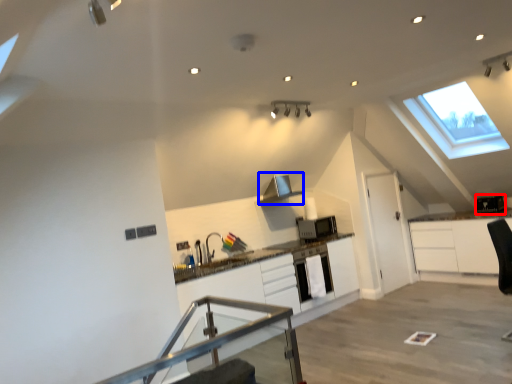
Question: Among these objects, which one is nearest to the camera, appliance (highlighted by a red box) or exhaust hood (highlighted by a blue box)?

Choices:
 (A) appliance
 (B) exhaust hood

Answer: (B)